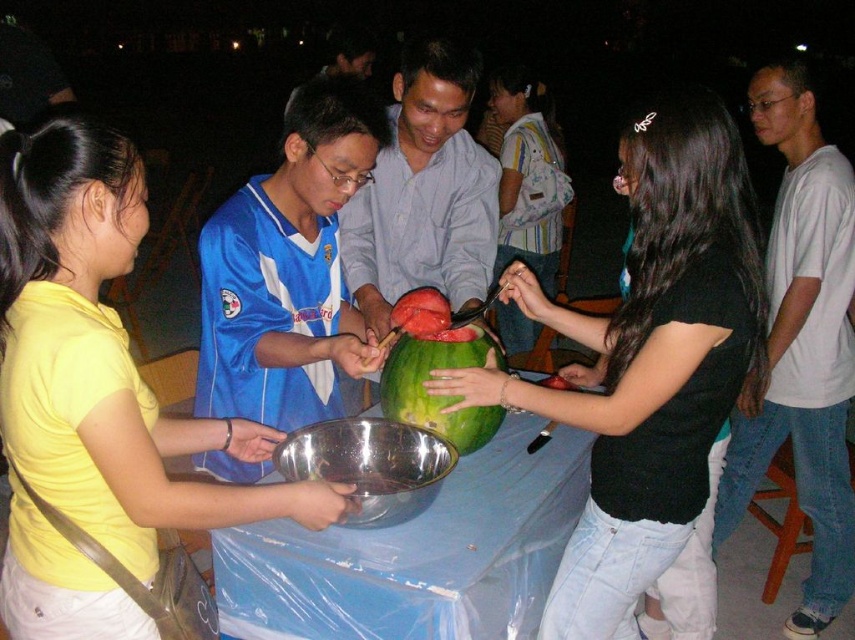
The image size is (855, 640). What do you see at coordinates (97, 396) in the screenshot?
I see `yellow matte shirt at left` at bounding box center [97, 396].

What are the coordinates of `yellow matte shirt at left` in the screenshot? It's located at (97, 396).

Where is `yellow matte shirt at left`? The width and height of the screenshot is (855, 640). yellow matte shirt at left is located at coordinates point(97,396).

The height and width of the screenshot is (640, 855). In order to click on yellow matte shirt at left in this screenshot , I will do [97, 396].

Does yellow matte shirt at left have a lesser height compared to green matte watermelon at center?

In fact, yellow matte shirt at left may be taller than green matte watermelon at center.

Is yellow matte shirt at left below green matte watermelon at center?

No.

Where is `yellow matte shirt at left`? yellow matte shirt at left is located at coordinates (97, 396).

This screenshot has height=640, width=855. What do you see at coordinates (417, 554) in the screenshot?
I see `blue plastic table at center` at bounding box center [417, 554].

Identify the location of blue plastic table at center. This screenshot has height=640, width=855. (417, 554).

The width and height of the screenshot is (855, 640). Find the location of `blue plastic table at center`. blue plastic table at center is located at coordinates [417, 554].